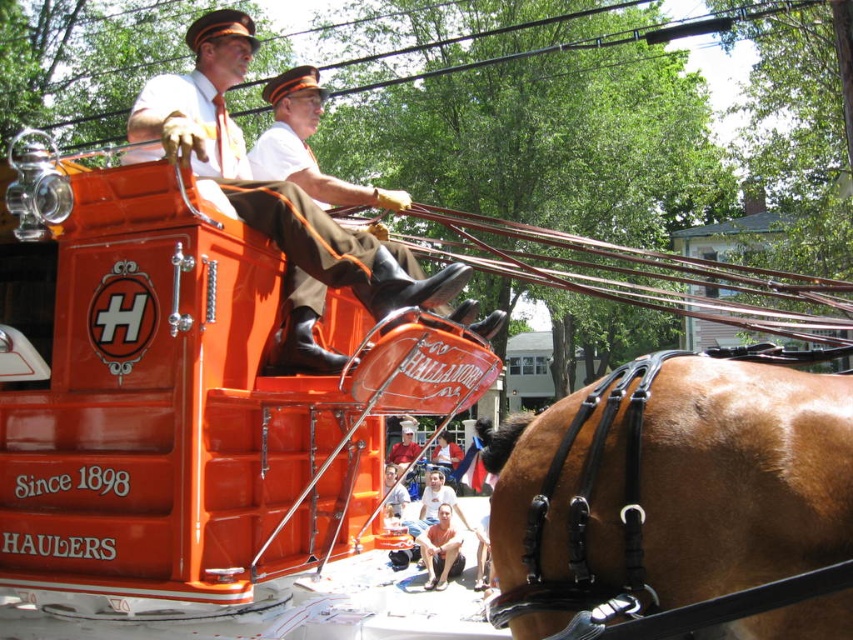
In the scene shown: Can you confirm if black wire at upper center is bigger than smooth white shirt at center?

Yes, black wire at upper center is bigger than smooth white shirt at center.

Is black wire at upper center to the left of smooth white shirt at center from the viewer's perspective?

Indeed, black wire at upper center is positioned on the left side of smooth white shirt at center.

Between point (340, 60) and point (392, 454), which one is positioned in front?

Point (392, 454) is in front.

Identify the location of black wire at upper center. (466, 40).

Who is positioned more to the left, brown leather shorts at lower center or smooth white shirt at center?

Positioned to the left is smooth white shirt at center.

Identify the location of brown leather shorts at lower center. (439, 547).

Is matte brown uniform at center bigger than brown leather shorts at lower center?

Yes.

The width and height of the screenshot is (853, 640). I want to click on matte brown uniform at center, so click(x=306, y=145).

Which is behind, point (488, 324) or point (445, 557)?

The point (445, 557) is behind.

Where is `matte brown uniform at center`? This screenshot has width=853, height=640. matte brown uniform at center is located at coordinates (306, 145).